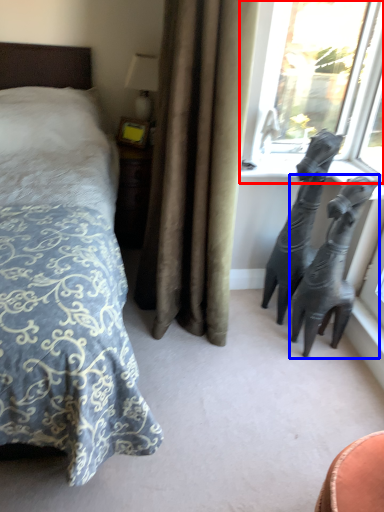
Question: Which object appears closest to the camera in this image, window (highlighted by a red box) or bronze sculpture (highlighted by a blue box)?

Choices:
 (A) window
 (B) bronze sculpture

Answer: (B)